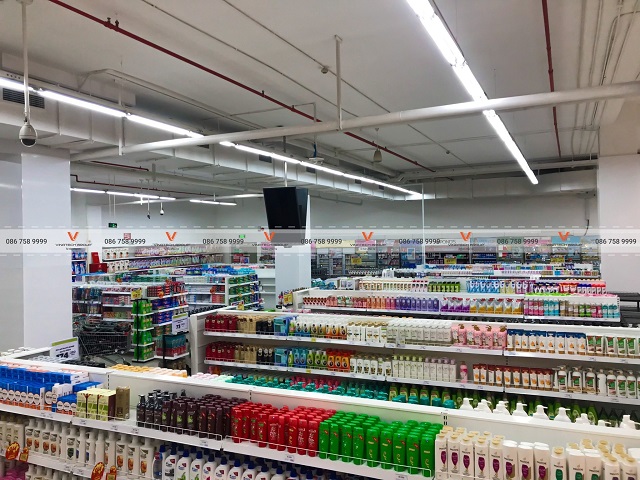
Find the location of a particular element. The image size is (640, 480). column is located at coordinates (x=41, y=282), (x=290, y=268).